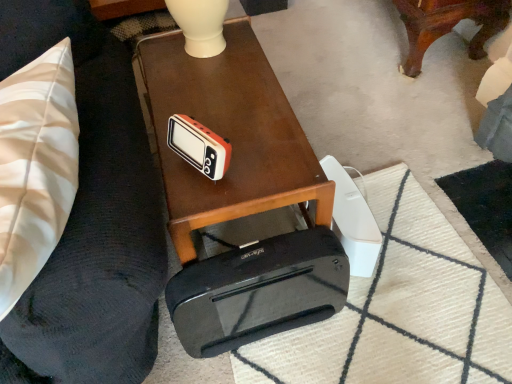
Question: Should I look upward or downward to see orange matte clock at center?

Choices:
 (A) down
 (B) up

Answer: (B)

Question: Does black plastic printer at lower center turn towards black rubber mat at lower center?

Choices:
 (A) yes
 (B) no

Answer: (B)

Question: Is there a large distance between black plastic printer at lower center and black rubber mat at lower center?

Choices:
 (A) yes
 (B) no

Answer: (B)

Question: Is black plastic printer at lower center thinner than black rubber mat at lower center?

Choices:
 (A) yes
 (B) no

Answer: (A)

Question: Considering the relative positions of black plastic printer at lower center and black rubber mat at lower center in the image provided, is black plastic printer at lower center in front of black rubber mat at lower center?

Choices:
 (A) no
 (B) yes

Answer: (B)

Question: Can you confirm if black plastic printer at lower center is smaller than black rubber mat at lower center?

Choices:
 (A) yes
 (B) no

Answer: (B)

Question: Could black rubber mat at lower center be considered to be inside black plastic printer at lower center?

Choices:
 (A) no
 (B) yes

Answer: (A)

Question: Considering the relative sizes of orange matte clock at center and black plastic cassette at lower center in the image provided, is orange matte clock at center thinner than black plastic cassette at lower center?

Choices:
 (A) yes
 (B) no

Answer: (A)

Question: From a real-world perspective, does orange matte clock at center stand above black plastic cassette at lower center?

Choices:
 (A) no
 (B) yes

Answer: (B)

Question: Is the depth of orange matte clock at center greater than that of black plastic cassette at lower center?

Choices:
 (A) no
 (B) yes

Answer: (A)

Question: Does orange matte clock at center appear on the left side of black plastic cassette at lower center?

Choices:
 (A) yes
 (B) no

Answer: (A)

Question: From a real-world perspective, is orange matte clock at center positioned under black plastic cassette at lower center based on gravity?

Choices:
 (A) yes
 (B) no

Answer: (B)

Question: From the image's perspective, is orange matte clock at center below black plastic cassette at lower center?

Choices:
 (A) no
 (B) yes

Answer: (A)

Question: Considering the relative sizes of black plastic cassette at lower center and orange matte clock at center in the image provided, is black plastic cassette at lower center shorter than orange matte clock at center?

Choices:
 (A) no
 (B) yes

Answer: (A)